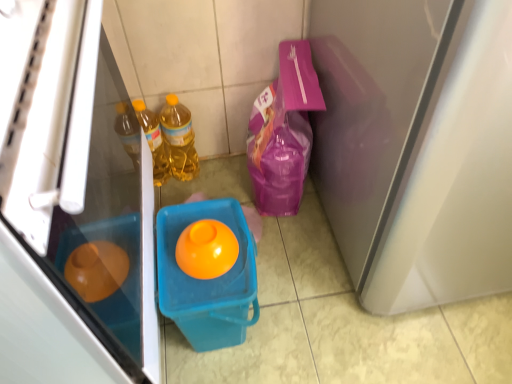
Identify the location of free spot to the right of translucent plastic bucket at center. The image size is (512, 384). (302, 302).